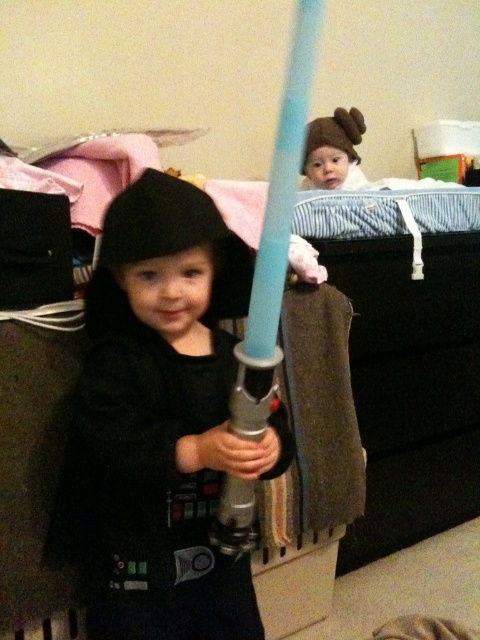
You are a photographer standing in the room and want to take a photo that includes both the point at coordinates point (158,419) and point (283,280). Which point should you focus on to ensure both are in sharp focus?

You should focus on point (283,280) because it is closer to the camera than point (158,419). By focusing on the closer point, the depth of field will likely include the farther point as well, ensuring both are in sharp focus.

You are a parent trying to ensure the safety of your children. You see the matte black costume at center and the baby bouncer with striped blue and white blanket in the background. Which object is closer to you?

The matte black costume at center is closer to you since they are 30.69 inches apart, meaning the distance between them is 30.69 inches, so the matte black costume at center is nearer.